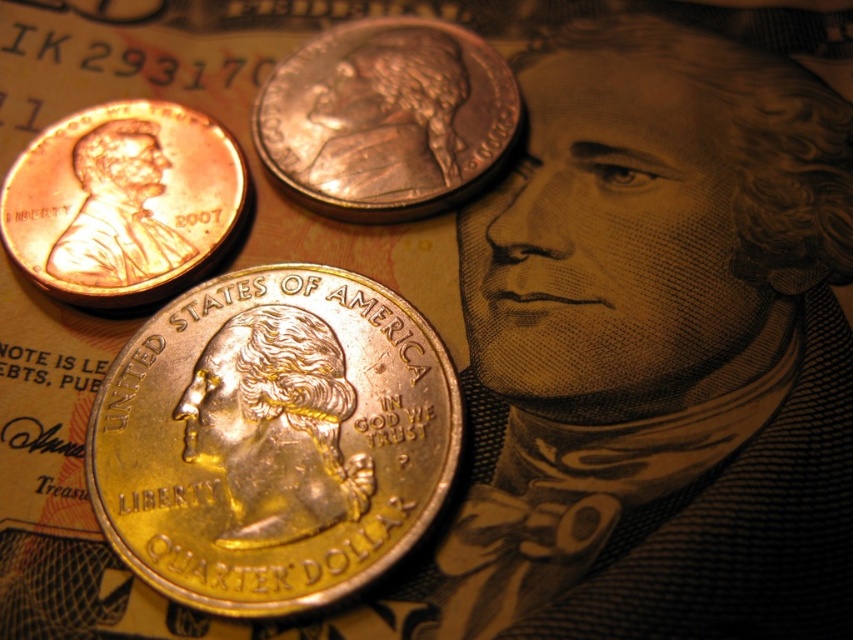
Which is more to the left, gold plated quarter at center or shiny copper coin at upper center?

From the viewer's perspective, gold plated quarter at center appears more on the left side.

From the picture: Can you confirm if gold plated quarter at center is wider than shiny copper coin at upper center?

Correct, the width of gold plated quarter at center exceeds that of shiny copper coin at upper center.

In order to click on gold plated quarter at center in this screenshot , I will do `click(273, 440)`.

Locate an element on the screen. gold plated quarter at center is located at coordinates (273, 440).

Does point (370, 128) lie behind point (167, 248)?

That is True.

Is shiny copper coin at upper center smaller than copper/brass penny at upper left?

No, shiny copper coin at upper center is not smaller than copper/brass penny at upper left.

Is point (416, 147) farther from viewer compared to point (172, 138)?

That is False.

Where is `shiny copper coin at upper center`? The height and width of the screenshot is (640, 853). shiny copper coin at upper center is located at coordinates (386, 116).

Who is more forward, (247,317) or (64,172)?

Point (247,317) is in front.

Consider the image. Which is more to the left, gold plated quarter at center or copper/brass penny at upper left?

Positioned to the left is copper/brass penny at upper left.

Is point (410, 308) behind point (106, 193)?

No.

Identify the location of gold plated quarter at center. (273, 440).